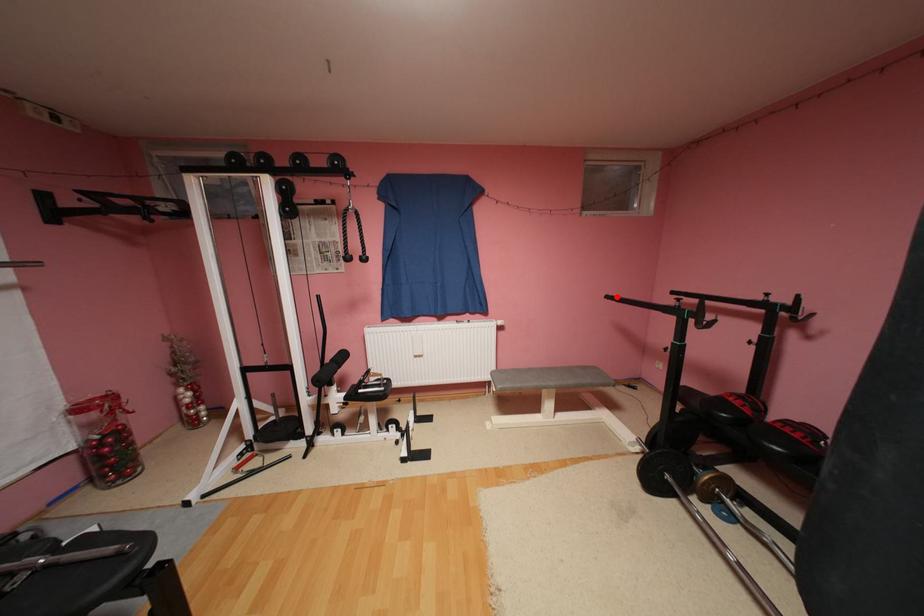
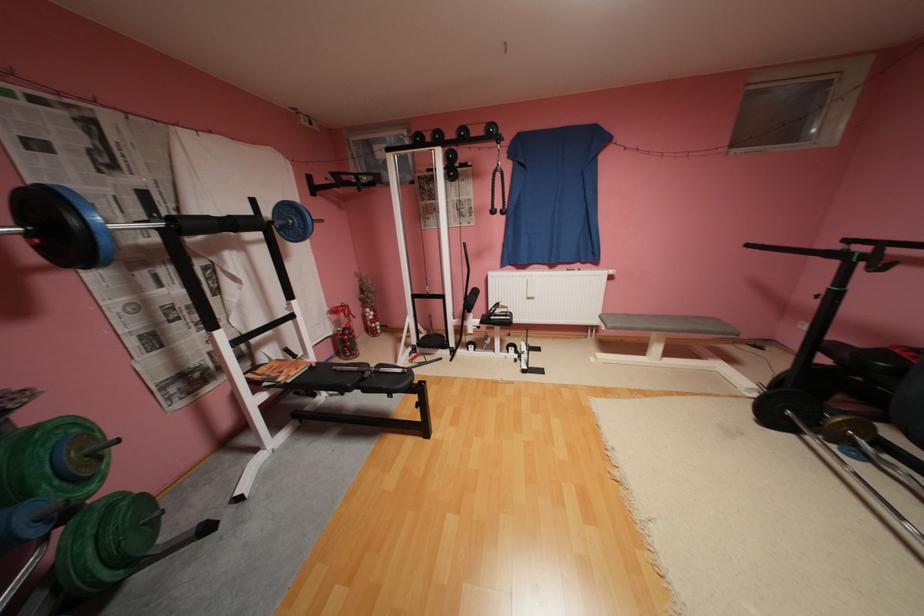
The point at the highlighted location is marked in the first image. Where is the corresponding point in the second image?

(757, 246)